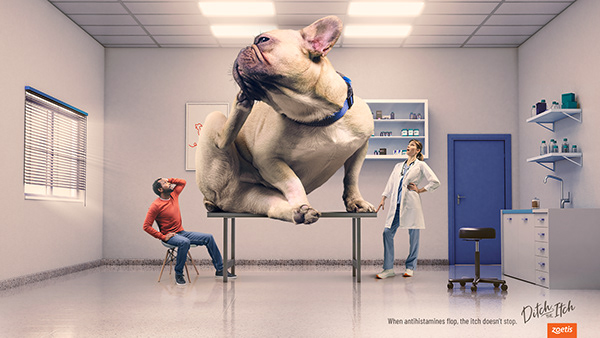
At what (x,y) coordinates should I click in order to perform the action: click on sink faucet. Please return your answer as a coordinate pair (x, y). Looking at the image, I should click on (561, 200).